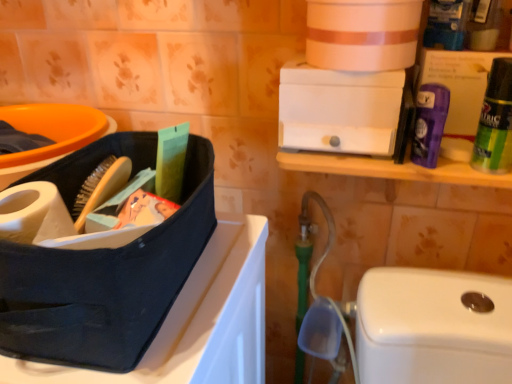
You are a GUI agent. You are given a task and a screenshot of the screen. Output one action in this format:
    pyautogui.click(x=<x>, y=<y>)
    Task: Click on the vacant space situated on the left part of purple matte deodorant at upper right, which is the 1th cleaning product from left to right
    The height and width of the screenshot is (384, 512).
    Given the screenshot: What is the action you would take?
    pyautogui.click(x=351, y=155)